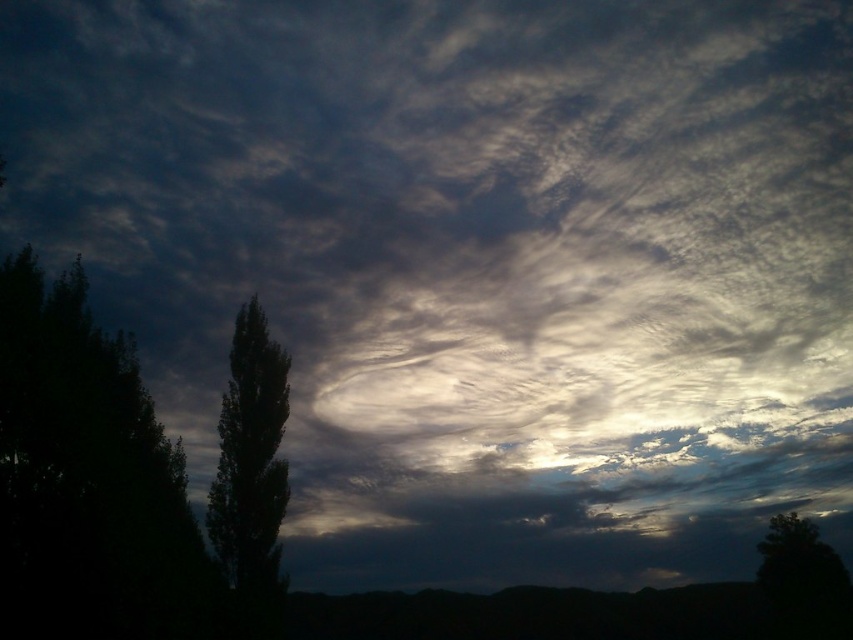
Question: Which of these objects is positioned closest to the green leafy tree at left?

Choices:
 (A) dark green leafy tree at left
 (B) dark green leafy tree at lower right

Answer: (A)

Question: Does dark green leafy tree at left appear on the left side of green leafy tree at left?

Choices:
 (A) no
 (B) yes

Answer: (B)

Question: Does dark green leafy tree at left have a smaller size compared to dark green leafy tree at lower right?

Choices:
 (A) no
 (B) yes

Answer: (A)

Question: Which is nearer to the dark green leafy tree at left?

Choices:
 (A) dark green leafy tree at lower right
 (B) green leafy tree at left

Answer: (B)

Question: Is dark green leafy tree at left to the right of dark green leafy tree at lower right from the viewer's perspective?

Choices:
 (A) yes
 (B) no

Answer: (B)

Question: Estimate the real-world distances between objects in this image. Which object is farther from the dark green leafy tree at left?

Choices:
 (A) green leafy tree at left
 (B) dark green leafy tree at lower right

Answer: (B)